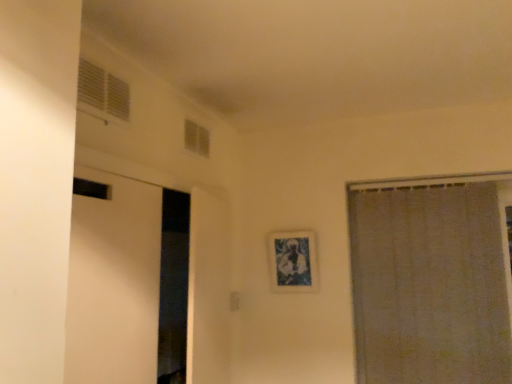
Question: From the image's perspective, is transparent glass window at upper center, which appears as the first window when viewed from the right, on top of white sheer curtain at right?

Choices:
 (A) yes
 (B) no

Answer: (A)

Question: From a real-world perspective, is transparent glass window at upper center, acting as the 2th window starting from the front, beneath white sheer curtain at right?

Choices:
 (A) no
 (B) yes

Answer: (A)

Question: Considering the relative positions of transparent glass window at upper center, positioned as the first window in back-to-front order, and white sheer curtain at right in the image provided, is transparent glass window at upper center, positioned as the first window in back-to-front order, to the left of white sheer curtain at right from the viewer's perspective?

Choices:
 (A) no
 (B) yes

Answer: (B)

Question: Does transparent glass window at upper center, positioned as the first window in back-to-front order, lie behind white sheer curtain at right?

Choices:
 (A) yes
 (B) no

Answer: (B)

Question: Can you confirm if transparent glass window at upper center, positioned as the first window in back-to-front order, is thinner than white sheer curtain at right?

Choices:
 (A) no
 (B) yes

Answer: (B)

Question: Is blue textured fabric picture frame at center wider or thinner than transparent glass window at upper center, acting as the 2th window starting from the front?

Choices:
 (A) thin
 (B) wide

Answer: (B)

Question: Which is correct: blue textured fabric picture frame at center is inside transparent glass window at upper center, acting as the 2th window starting from the front, or outside of it?

Choices:
 (A) inside
 (B) outside

Answer: (B)

Question: From the image's perspective, relative to transparent glass window at upper center, which appears as the first window when viewed from the right, is blue textured fabric picture frame at center above or below?

Choices:
 (A) below
 (B) above

Answer: (A)

Question: Looking at the image, does blue textured fabric picture frame at center seem bigger or smaller compared to transparent glass window at upper center, which appears as the first window when viewed from the right?

Choices:
 (A) big
 (B) small

Answer: (A)

Question: Is transparent glass window at upper center, which appears as the first window when viewed from the right, spatially inside white plastic vent at upper left, which ranks as the second window in right-to-left order, or outside of it?

Choices:
 (A) outside
 (B) inside

Answer: (A)

Question: Is transparent glass window at upper center, which appears as the first window when viewed from the right, to the left or to the right of white plastic vent at upper left, which appears as the first window when viewed from the front, in the image?

Choices:
 (A) left
 (B) right

Answer: (B)

Question: Is transparent glass window at upper center, acting as the 2th window starting from the front, taller or shorter than white plastic vent at upper left, the second window in the back-to-front sequence?

Choices:
 (A) tall
 (B) short

Answer: (B)

Question: In the image, is transparent glass window at upper center, positioned as the first window in back-to-front order, positioned in front of or behind white plastic vent at upper left, which ranks as the first window in left-to-right order?

Choices:
 (A) front
 (B) behind

Answer: (B)

Question: Is point (129, 92) closer or farther from the camera than point (365, 339)?

Choices:
 (A) closer
 (B) farther

Answer: (A)

Question: From the image's perspective, relative to white sheer curtain at right, is white plastic vent at upper left, which ranks as the second window in right-to-left order, above or below?

Choices:
 (A) above
 (B) below

Answer: (A)